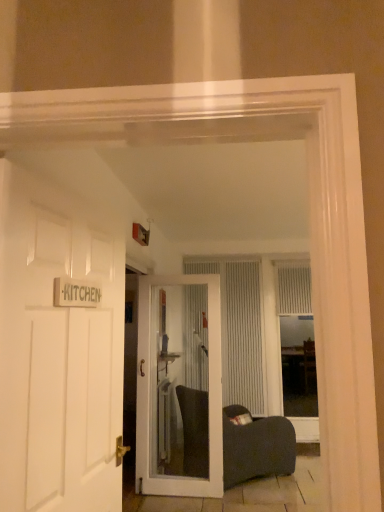
Question: Is white wooden door at left, arranged as the second door when viewed from the back, not within clear glass door at center, acting as the 1th door starting from the back?

Choices:
 (A) no
 (B) yes

Answer: (B)

Question: Is white wooden door at left, the first door viewed from the front, taller than clear glass door at center, positioned as the second door in front-to-back order?

Choices:
 (A) no
 (B) yes

Answer: (A)

Question: Can you confirm if white wooden door at left, the first door viewed from the front, is bigger than clear glass door at center, positioned as the second door in front-to-back order?

Choices:
 (A) yes
 (B) no

Answer: (B)

Question: Does white wooden door at left, the first door viewed from the front, appear on the left side of clear glass door at center, positioned as the second door in front-to-back order?

Choices:
 (A) no
 (B) yes

Answer: (B)

Question: Is white wooden door at left, the first door viewed from the front, surrounding clear glass door at center, acting as the 1th door starting from the back?

Choices:
 (A) no
 (B) yes

Answer: (A)

Question: Considering their positions, is clear glass door at center, positioned as the second door in front-to-back order, located in front of or behind white textured blinds at center?

Choices:
 (A) behind
 (B) front

Answer: (B)

Question: Is clear glass door at center, acting as the 1th door starting from the back, spatially inside white textured blinds at center, or outside of it?

Choices:
 (A) inside
 (B) outside

Answer: (B)

Question: In terms of height, does clear glass door at center, acting as the 1th door starting from the back, look taller or shorter compared to white textured blinds at center?

Choices:
 (A) short
 (B) tall

Answer: (A)

Question: Is clear glass door at center, acting as the 1th door starting from the back, wider or thinner than white textured blinds at center?

Choices:
 (A) thin
 (B) wide

Answer: (B)

Question: In terms of size, does white textured curtain at center, which ranks as the second curtain in left-to-right order, appear bigger or smaller than white textured blinds at center?

Choices:
 (A) small
 (B) big

Answer: (A)

Question: Does point (301, 271) appear closer or farther from the camera than point (289, 266)?

Choices:
 (A) farther
 (B) closer

Answer: (A)

Question: Is white textured curtain at center, which ranks as the second curtain in left-to-right order, inside the boundaries of white textured blinds at center, or outside?

Choices:
 (A) outside
 (B) inside

Answer: (B)

Question: Relative to white textured blinds at center, is white textured curtain at center, acting as the first curtain starting from the right, in front or behind?

Choices:
 (A) front
 (B) behind

Answer: (B)

Question: From the image's perspective, is white textured curtain at center, which appears as the 1th curtain when viewed from the left, located above or below white textured curtain at center, acting as the first curtain starting from the right?

Choices:
 (A) above
 (B) below

Answer: (B)

Question: Is white textured curtain at center, the second curtain from the right, situated inside white textured curtain at center, which ranks as the second curtain in left-to-right order, or outside?

Choices:
 (A) outside
 (B) inside

Answer: (A)